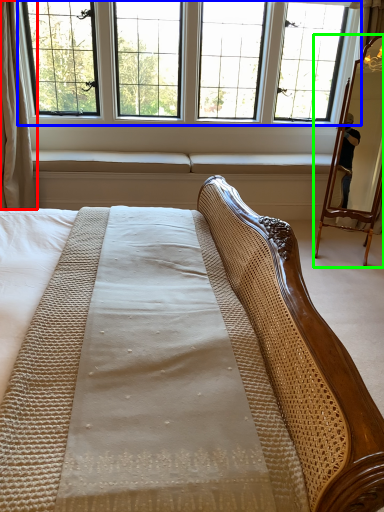
Question: Which object is the farthest from curtain (highlighted by a red box)? Choose among these: window (highlighted by a blue box) or mirror (highlighted by a green box).

Choices:
 (A) window
 (B) mirror

Answer: (B)